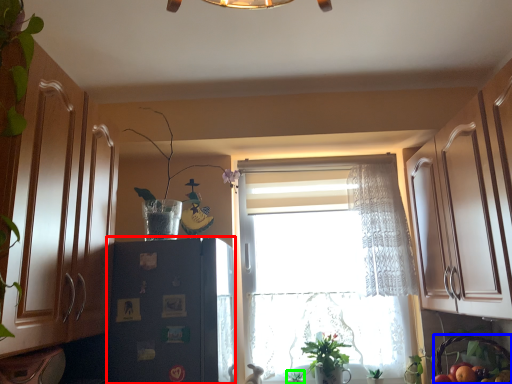
Question: Considering the real-world distances, which object is farthest from fridge (highlighted by a red box)? basket (highlighted by a blue box) or plant (highlighted by a green box)?

Choices:
 (A) basket
 (B) plant

Answer: (A)